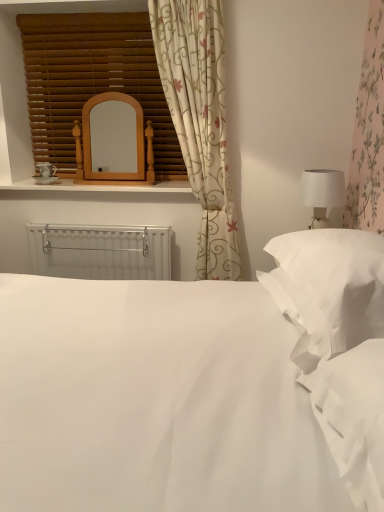
Based on the photo, what is the approximate width of wooden blinds at upper left?

wooden blinds at upper left is 5.59 inches wide.

Where is `white soft pillow at right`? white soft pillow at right is located at coordinates (328, 289).

What do you see at coordinates (100, 251) in the screenshot?
I see `white plastic radiator at center` at bounding box center [100, 251].

At what (x,y) coordinates should I click in order to perform the action: click on wooden mirror at upper center. Please return your answer as a coordinate pair (x, y). The image size is (384, 512). Looking at the image, I should click on (113, 138).

Which of these two, wooden mirror at upper center or wooden blinds at upper left, stands taller?

Standing taller between the two is wooden blinds at upper left.

Locate an element on the screen. This screenshot has width=384, height=512. window blind to the left of wooden mirror at upper center is located at coordinates (92, 80).

Is wooden blinds at upper left located within wooden mirror at upper center?

No, wooden blinds at upper left is not a part of wooden mirror at upper center.

Between point (102, 143) and point (58, 97), which one is positioned in front?

The point (102, 143) is closer to the camera.

Considering the relative sizes of wooden blinds at upper left and wooden mirror at upper center in the image provided, is wooden blinds at upper left wider than wooden mirror at upper center?

No, wooden blinds at upper left is not wider than wooden mirror at upper center.

Measure the distance between wooden blinds at upper left and wooden mirror at upper center.

A distance of 9.82 inches exists between wooden blinds at upper left and wooden mirror at upper center.

Would you say wooden blinds at upper left is a long distance from wooden mirror at upper center?

That's not correct — wooden blinds at upper left is a little close to wooden mirror at upper center.

From the image's perspective, which one is positioned lower, wooden blinds at upper left or wooden mirror at upper center?

From the image's view, wooden mirror at upper center is below.

From the picture: Which of these two, wooden blinds at upper left or white smooth bed at center, is thinner?

Thinner between the two is wooden blinds at upper left.

From the image's perspective, does wooden blinds at upper left appear higher than white smooth bed at center?

Yes, from the image's perspective, wooden blinds at upper left is above white smooth bed at center.

Does wooden blinds at upper left lie in front of white smooth bed at center?

No, wooden blinds at upper left is further to the viewer.

Is wooden blinds at upper left next to white smooth bed at center and touching it?

No, wooden blinds at upper left is not next to white smooth bed at center.

Does woodenmaterial/texturewindow sill at upper center have a lesser height compared to wooden blinds at upper left?

Yes.

Based on the photo, which object is closer to the camera, woodenmaterial/texturewindow sill at upper center or wooden blinds at upper left?

woodenmaterial/texturewindow sill at upper center is closer to the camera.

Is woodenmaterial/texturewindow sill at upper center turned away from wooden blinds at upper left?

That's not correct — woodenmaterial/texturewindow sill at upper center is not looking away from wooden blinds at upper left.

Can you confirm if woodenmaterial/texturewindow sill at upper center is wider than wooden blinds at upper left?

Yes.

Is white matte table lamp at right in front of white plastic radiator at center?

Yes, it is.

Based on the photo, between white matte table lamp at right and white plastic radiator at center, which one appears on the left side from the viewer's perspective?

white plastic radiator at center is more to the left.

At what (x,y) coordinates should I click in order to perform the action: click on table lamp in front of the white plastic radiator at center. Please return your answer as a coordinate pair (x, y). Looking at the image, I should click on click(322, 193).

Which is farther, (325, 217) or (131, 248)?

The point (131, 248) is behind.

From a real-world perspective, is white matte table lamp at right on wooden blinds at upper left?

No.

Is white matte table lamp at right further to the viewer compared to wooden blinds at upper left?

No.

Is white matte table lamp at right next to wooden blinds at upper left and touching it?

No, white matte table lamp at right is not making contact with wooden blinds at upper left.

Does point (330, 189) come closer to viewer compared to point (99, 83)?

That is True.

Is floral fabric curtain at upper center situated inside white smooth bed at center or outside?

floral fabric curtain at upper center is spatially situated outside white smooth bed at center.

Which of these two, floral fabric curtain at upper center or white smooth bed at center, is smaller?

With smaller size is floral fabric curtain at upper center.

Looking at this image, is floral fabric curtain at upper center oriented away from white smooth bed at center?

No, floral fabric curtain at upper center's orientation is not away from white smooth bed at center.

Where is `mirror that appears below the wooden blinds at upper left (from the image's perspective)`? mirror that appears below the wooden blinds at upper left (from the image's perspective) is located at coordinates (113, 138).

Identify the location of window blind that appears on the left of wooden mirror at upper center. (92, 80).

From the image, which object appears to be nearer to white smooth bed at center, wooden blinds at upper left or wooden mirror at upper center?

Among the two, wooden mirror at upper center is located nearer to white smooth bed at center.

Estimate the real-world distances between objects in this image. Which object is further from white smooth bed at center, white plastic radiator at center or wooden blinds at upper left?

Based on the image, wooden blinds at upper left appears to be further to white smooth bed at center.

Considering their positions, is wooden mirror at upper center positioned closer to white plastic radiator at center than woodenmaterial/texturewindow sill at upper center?

woodenmaterial/texturewindow sill at upper center lies closer to white plastic radiator at center than the other object.

From the image, which object appears to be farther from white plastic radiator at center, white smooth bed at center or woodenmaterial/texturewindow sill at upper center?

white smooth bed at center.

Based on their spatial positions, is woodenmaterial/texturewindow sill at upper center or floral fabric curtain at upper center closer to white smooth bed at center?

floral fabric curtain at upper center.

When comparing their distances from white plastic radiator at center, does wooden blinds at upper left or white matte table lamp at right seem closer?

The object closer to white plastic radiator at center is wooden blinds at upper left.

Which object lies further to the anchor point white plastic radiator at center, wooden mirror at upper center or white smooth bed at center?

Among the two, white smooth bed at center is located further to white plastic radiator at center.

Looking at the image, which one is located closer to white plastic radiator at center, floral fabric curtain at upper center or wooden blinds at upper left?

Based on the image, floral fabric curtain at upper center appears to be nearer to white plastic radiator at center.

This screenshot has width=384, height=512. What are the coordinates of `table lamp between white smooth bed at center and woodenmaterial/texturewindow sill at upper center along the z-axis` in the screenshot? It's located at (322, 193).

Find the location of a particular element. The height and width of the screenshot is (512, 384). window sill between wooden mirror at upper center and white plastic radiator at center in the vertical direction is located at coordinates (101, 186).

Find the location of a particular element. The height and width of the screenshot is (512, 384). mirror between white soft pillow at right and white plastic radiator at center along the z-axis is located at coordinates (113, 138).

This screenshot has width=384, height=512. In order to click on curtain located between white smooth bed at center and white plastic radiator at center in the depth direction in this screenshot , I will do pyautogui.click(x=200, y=121).